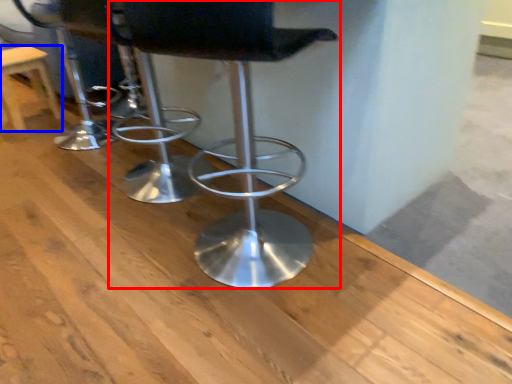
Question: Which object appears closest to the camera in this image, chair (highlighted by a red box) or stool (highlighted by a blue box)?

Choices:
 (A) chair
 (B) stool

Answer: (A)